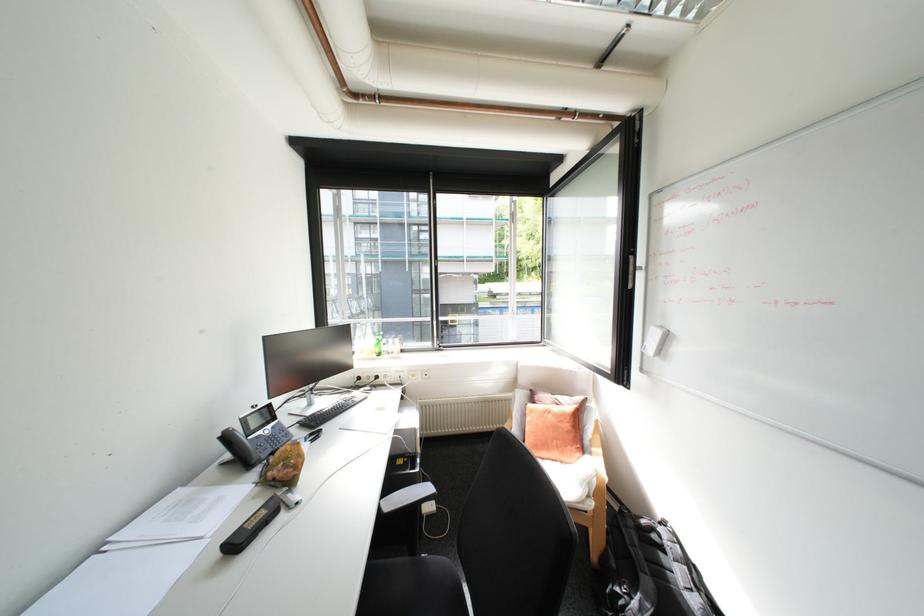
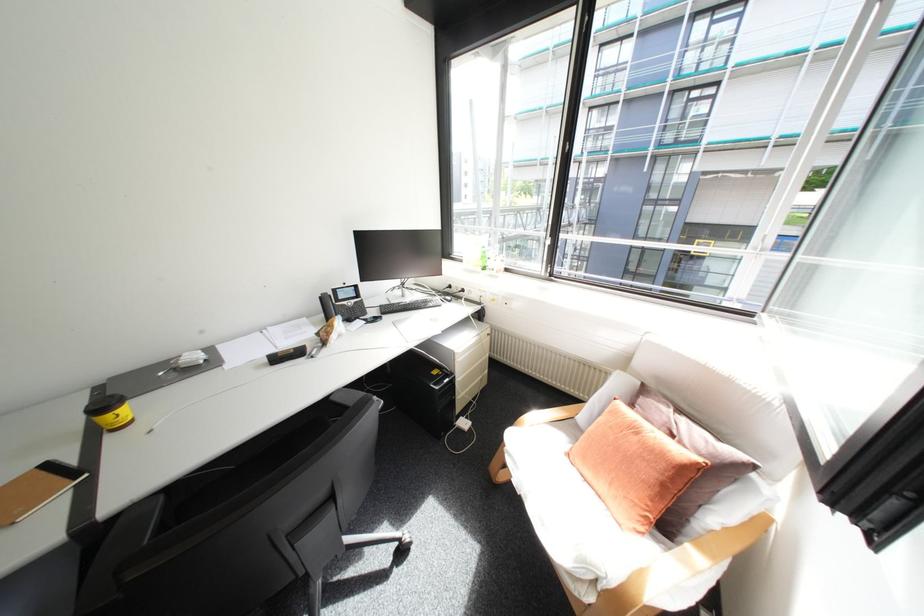
Where in the second image is the point corresponding to the point at 382,353 from the first image?

(487, 265)